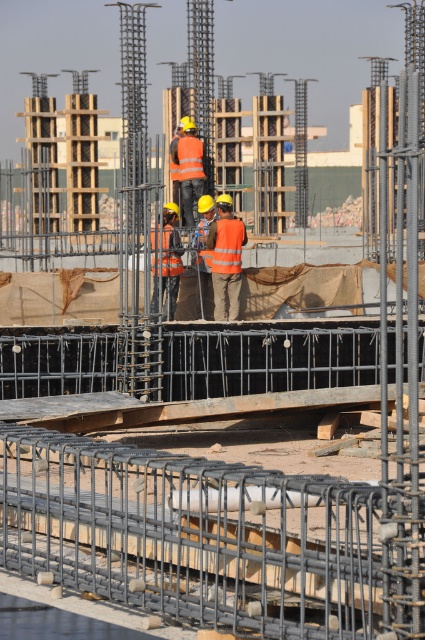
You are a safety inspector at the construction site. You notice two orange reflective vests in the scene. One is labeled as the reflective orange vest at center and the other as the orange reflective vest at center. Which one is wider?

The reflective orange vest at center is wider than the orange reflective vest at center according to the description.